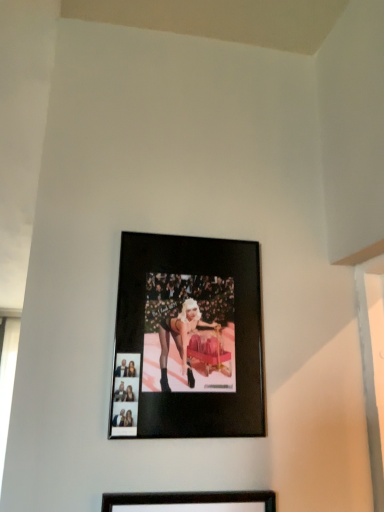
Image resolution: width=384 pixels, height=512 pixels. Describe the element at coordinates (187, 339) in the screenshot. I see `black matte picture frame at center, the first picture frame positioned from the top` at that location.

Where is `black matte picture frame at center, the first picture frame positioned from the top`? The height and width of the screenshot is (512, 384). black matte picture frame at center, the first picture frame positioned from the top is located at coordinates (187, 339).

Based on the photo, measure the distance between point (256,402) and camera.

33.94 inches.

What do you see at coordinates (190, 502) in the screenshot? I see `black matte picture frame at center, which is the second picture frame from top to bottom` at bounding box center [190, 502].

This screenshot has height=512, width=384. What are the coordinates of `black matte picture frame at center, placed as the 2th picture frame when sorted from back to front` in the screenshot? It's located at (190, 502).

You are a GUI agent. You are given a task and a screenshot of the screen. Output one action in this format:
    pyautogui.click(x=<x>, y=<y>)
    Task: Click on the black matte picture frame at center, which ranks as the 2th picture frame in bottom-to-top order
    The height and width of the screenshot is (512, 384).
    Given the screenshot: What is the action you would take?
    pyautogui.click(x=187, y=339)

Considering the positions of objects black matte picture frame at center, placed as the 2th picture frame when sorted from back to front, and black matte picture frame at center, the second picture frame when ordered from front to back, in the image provided, who is more to the right, black matte picture frame at center, placed as the 2th picture frame when sorted from back to front, or black matte picture frame at center, the second picture frame when ordered from front to back,?

Positioned to the right is black matte picture frame at center, the second picture frame when ordered from front to back.

Which object is more forward, black matte picture frame at center, which ranks as the 1th picture frame in front-to-back order, or black matte picture frame at center, marked as the first picture frame in a back-to-front arrangement?

black matte picture frame at center, which ranks as the 1th picture frame in front-to-back order, is more forward.

Which is more distant, (178, 507) or (192, 385)?

The point (192, 385) is behind.

From the image's perspective, which one is positioned lower, black matte picture frame at center, placed as the 2th picture frame when sorted from back to front, or black matte picture frame at center, the first picture frame positioned from the top?

From the image's view, black matte picture frame at center, placed as the 2th picture frame when sorted from back to front, is below.

Looking at this image, from a real-world perspective, which is physically below, black matte picture frame at center, the 1th picture frame ordered from the bottom, or black matte picture frame at center, which ranks as the 2th picture frame in bottom-to-top order?

black matte picture frame at center, the 1th picture frame ordered from the bottom, is physically lower.

Which object is wider, black matte picture frame at center, the 1th picture frame ordered from the bottom, or black matte picture frame at center, the first picture frame positioned from the top?

With larger width is black matte picture frame at center, the first picture frame positioned from the top.

Considering the relative sizes of black matte picture frame at center, the 1th picture frame ordered from the bottom, and black matte picture frame at center, the first picture frame positioned from the top, in the image provided, is black matte picture frame at center, the 1th picture frame ordered from the bottom, shorter than black matte picture frame at center, the first picture frame positioned from the top,?

No, black matte picture frame at center, the 1th picture frame ordered from the bottom, is not shorter than black matte picture frame at center, the first picture frame positioned from the top.

Considering the sizes of objects black matte picture frame at center, which ranks as the 1th picture frame in front-to-back order, and black matte picture frame at center, the second picture frame when ordered from front to back, in the image provided, who is bigger, black matte picture frame at center, which ranks as the 1th picture frame in front-to-back order, or black matte picture frame at center, the second picture frame when ordered from front to back,?

black matte picture frame at center, the second picture frame when ordered from front to back, is bigger.

Could black matte picture frame at center, marked as the first picture frame in a back-to-front arrangement, be considered to be inside black matte picture frame at center, which ranks as the 1th picture frame in front-to-back order?

No, black matte picture frame at center, marked as the first picture frame in a back-to-front arrangement, is not surrounded by black matte picture frame at center, which ranks as the 1th picture frame in front-to-back order.

Is black matte picture frame at center, which ranks as the 1th picture frame in front-to-back order, far away from black matte picture frame at center, marked as the first picture frame in a back-to-front arrangement?

No, black matte picture frame at center, which ranks as the 1th picture frame in front-to-back order, is not far away from black matte picture frame at center, marked as the first picture frame in a back-to-front arrangement.

Consider the image. Is black matte picture frame at center, placed as the 2th picture frame when sorted from back to front, oriented towards black matte picture frame at center, which ranks as the 2th picture frame in bottom-to-top order?

No.

How different are the orientations of black matte picture frame at center, which ranks as the 1th picture frame in front-to-back order, and black matte picture frame at center, the second picture frame when ordered from front to back, in degrees?

black matte picture frame at center, which ranks as the 1th picture frame in front-to-back order, and black matte picture frame at center, the second picture frame when ordered from front to back, are facing 0.00301 degrees away from each other.

Where is `picture frame above the black matte picture frame at center, which is the second picture frame from top to bottom (from the image's perspective)`? This screenshot has width=384, height=512. picture frame above the black matte picture frame at center, which is the second picture frame from top to bottom (from the image's perspective) is located at coordinates (187, 339).

Considering the relative positions of black matte picture frame at center, which ranks as the 2th picture frame in bottom-to-top order, and black matte picture frame at center, which is the second picture frame from top to bottom, in the image provided, is black matte picture frame at center, which ranks as the 2th picture frame in bottom-to-top order, to the left of black matte picture frame at center, which is the second picture frame from top to bottom, from the viewer's perspective?

Result: In fact, black matte picture frame at center, which ranks as the 2th picture frame in bottom-to-top order, is to the right of black matte picture frame at center, which is the second picture frame from top to bottom.

Which is in front, black matte picture frame at center, the second picture frame when ordered from front to back, or black matte picture frame at center, placed as the 2th picture frame when sorted from back to front?

black matte picture frame at center, placed as the 2th picture frame when sorted from back to front, is more forward.

Does point (195, 394) appear closer or farther from the camera than point (248, 492)?

Point (195, 394) is farther from the camera than point (248, 492).

From the image's perspective, who appears lower, black matte picture frame at center, which ranks as the 2th picture frame in bottom-to-top order, or black matte picture frame at center, which is the second picture frame from top to bottom?

black matte picture frame at center, which is the second picture frame from top to bottom, appears lower in the image.

From a real-world perspective, does black matte picture frame at center, the second picture frame when ordered from front to back, sit lower than black matte picture frame at center, placed as the 2th picture frame when sorted from back to front?

Actually, black matte picture frame at center, the second picture frame when ordered from front to back, is physically above black matte picture frame at center, placed as the 2th picture frame when sorted from back to front, in the real world.

Is black matte picture frame at center, the second picture frame when ordered from front to back, thinner than black matte picture frame at center, which is the second picture frame from top to bottom?

No, black matte picture frame at center, the second picture frame when ordered from front to back, is not thinner than black matte picture frame at center, which is the second picture frame from top to bottom.

Considering the relative sizes of black matte picture frame at center, the first picture frame positioned from the top, and black matte picture frame at center, the 1th picture frame ordered from the bottom, in the image provided, is black matte picture frame at center, the first picture frame positioned from the top, taller than black matte picture frame at center, the 1th picture frame ordered from the bottom,?

No, black matte picture frame at center, the first picture frame positioned from the top, is not taller than black matte picture frame at center, the 1th picture frame ordered from the bottom.

Is black matte picture frame at center, which ranks as the 2th picture frame in bottom-to-top order, smaller than black matte picture frame at center, the 1th picture frame ordered from the bottom?

No.

Is black matte picture frame at center, the first picture frame positioned from the top, not inside black matte picture frame at center, which is the second picture frame from top to bottom?

Yes.

Are black matte picture frame at center, the first picture frame positioned from the top, and black matte picture frame at center, which ranks as the 1th picture frame in front-to-back order, located far from each other?

No, black matte picture frame at center, the first picture frame positioned from the top, is in close proximity to black matte picture frame at center, which ranks as the 1th picture frame in front-to-back order.

Could you tell me if black matte picture frame at center, marked as the first picture frame in a back-to-front arrangement, is turned towards black matte picture frame at center, placed as the 2th picture frame when sorted from back to front?

No, black matte picture frame at center, marked as the first picture frame in a back-to-front arrangement, is not aimed at black matte picture frame at center, placed as the 2th picture frame when sorted from back to front.

Could you measure the distance between black matte picture frame at center, which ranks as the 2th picture frame in bottom-to-top order, and black matte picture frame at center, which ranks as the 1th picture frame in front-to-back order?

The distance of black matte picture frame at center, which ranks as the 2th picture frame in bottom-to-top order, from black matte picture frame at center, which ranks as the 1th picture frame in front-to-back order, is 10.87 inches.

Locate an element on the screen. The image size is (384, 512). picture frame that is under the black matte picture frame at center, the second picture frame when ordered from front to back (from a real-world perspective) is located at coordinates (190, 502).

At what (x,y) coordinates should I click in order to perform the action: click on picture frame behind the black matte picture frame at center, which ranks as the 1th picture frame in front-to-back order. Please return your answer as a coordinate pair (x, y). Looking at the image, I should click on (187, 339).

Identify the location of picture frame in front of the black matte picture frame at center, the second picture frame when ordered from front to back. This screenshot has width=384, height=512. (190, 502).